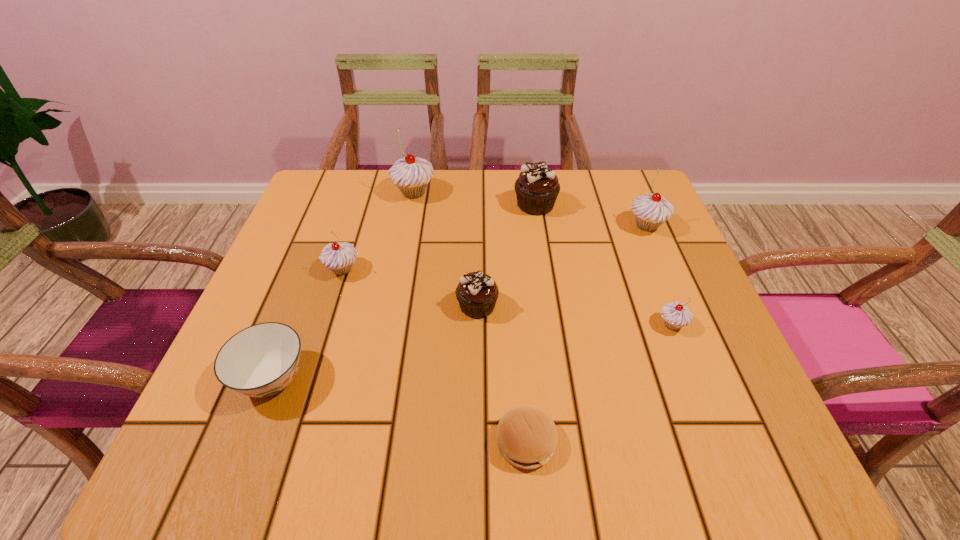
Identify the location of blank area in the image that satisfies the following two spatial constraints: 1. on the front side of the biggest gray cupcake; 2. on the left side of the second tallest object. Image resolution: width=960 pixels, height=540 pixels. (408, 226).

Where is `vacant space that satisfies the following two spatial constraints: 1. on the back side of the third biggest gray cupcake; 2. on the left side of the farther brown cupcake`? vacant space that satisfies the following two spatial constraints: 1. on the back side of the third biggest gray cupcake; 2. on the left side of the farther brown cupcake is located at coordinates (363, 205).

You are a GUI agent. You are given a task and a screenshot of the screen. Output one action in this format:
    pyautogui.click(x=<x>, y=<y>)
    Task: Click on the free spot that satisfies the following two spatial constraints: 1. on the front side of the right brown cupcake; 2. on the right side of the sixth object from right to left
    
    Given the screenshot: What is the action you would take?
    pyautogui.click(x=412, y=205)